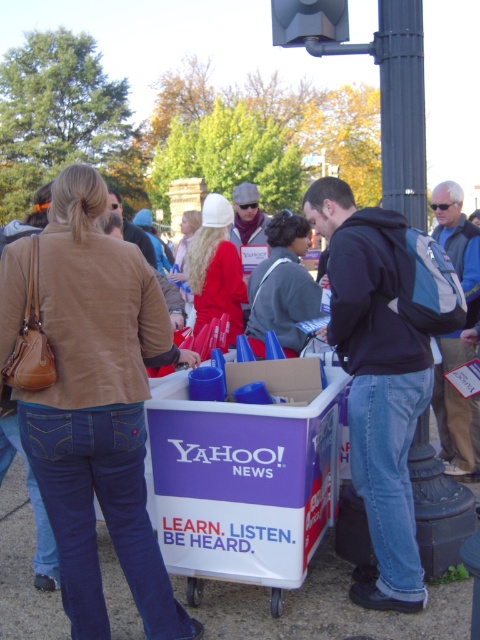
Between purple cardboard cart at center and black matte backpack at center, which one is positioned higher?

black matte backpack at center is above.

Locate an element on the screen. purple cardboard cart at center is located at coordinates (92, 401).

Locate an element on the screen. This screenshot has width=480, height=640. purple cardboard cart at center is located at coordinates (92, 401).